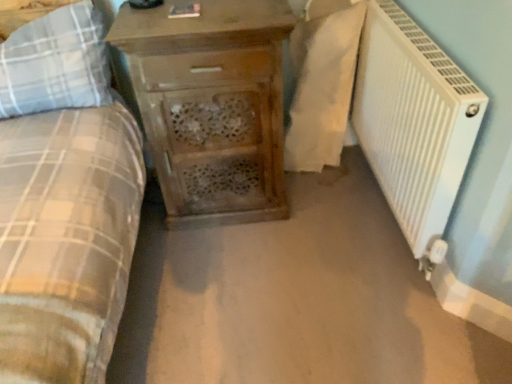
This screenshot has height=384, width=512. What do you see at coordinates (55, 63) in the screenshot? I see `plaid fabric pillow at left` at bounding box center [55, 63].

Measure the distance between point [21,52] and camera.

Point [21,52] is 4.49 feet away from camera.

The image size is (512, 384). Describe the element at coordinates (322, 88) in the screenshot. I see `white fabric at right` at that location.

At what (x,y) coordinates should I click in order to perform the action: click on white fabric at right. Please return your answer as a coordinate pair (x, y). The image size is (512, 384). Looking at the image, I should click on (322, 88).

What is the approximate width of white textured radiator at right?

white textured radiator at right is 11.91 centimeters in width.

The height and width of the screenshot is (384, 512). What do you see at coordinates (414, 124) in the screenshot?
I see `white textured radiator at right` at bounding box center [414, 124].

What do you see at coordinates (211, 106) in the screenshot?
I see `wooden chest of drawers at center` at bounding box center [211, 106].

Locate an element on the screen. The image size is (512, 384). plaid fabric pillow at left is located at coordinates [55, 63].

Visually, is wooden chest of drawers at center positioned to the left or to the right of plaid fabric pillow at left?

wooden chest of drawers at center is positioned on plaid fabric pillow at left's right side.

Which of these two, wooden chest of drawers at center or plaid fabric pillow at left, is thinner?

plaid fabric pillow at left is thinner.

Is wooden chest of drawers at center facing away from plaid fabric pillow at left?

No, wooden chest of drawers at center is not facing away from plaid fabric pillow at left.

Between white textured radiator at right and plaid fabric pillow at left, which one has larger size?

white textured radiator at right is bigger.

What are the coordinates of `pillow lying above the white textured radiator at right (from the image's perspective)` in the screenshot? It's located at (55, 63).

How far apart are white textured radiator at right and plaid fabric pillow at left?

They are 1.07 meters apart.

Considering the points (366, 120) and (101, 61), which point is behind, point (366, 120) or point (101, 61)?

The point (366, 120) is farther.

Would you say white fabric at right is inside or outside wooden chest of drawers at center?

white fabric at right cannot be found inside wooden chest of drawers at center.

Is white fabric at right facing away from wooden chest of drawers at center?

That's not correct — white fabric at right is not looking away from wooden chest of drawers at center.

Which of these two, white fabric at right or wooden chest of drawers at center, is wider?

With larger width is wooden chest of drawers at center.

Who is bigger, white fabric at right or wooden chest of drawers at center?

wooden chest of drawers at center.

Is point (317, 23) closer to viewer compared to point (412, 95)?

No, it is not.

Based on the photo, relative to white textured radiator at right, is white fabric at right in front or behind?

white fabric at right is positioned farther from the viewer than white textured radiator at right.

Is white fabric at right spatially inside white textured radiator at right, or outside of it?

white fabric at right exists outside the volume of white textured radiator at right.

Is white textured radiator at right at the back of white fabric at right?

No, white fabric at right's orientation is not away from white textured radiator at right.

Is plaid fabric pillow at left thinner than white textured radiator at right?

No, plaid fabric pillow at left is not thinner than white textured radiator at right.

Is white textured radiator at right at the back of plaid fabric pillow at left?

plaid fabric pillow at left does not have its back to white textured radiator at right.

Who is shorter, plaid fabric pillow at left or white textured radiator at right?

Standing shorter between the two is plaid fabric pillow at left.

From the image's perspective, which one is positioned higher, plaid fabric pillow at left or white textured radiator at right?

plaid fabric pillow at left.

Looking at this image, is wooden chest of drawers at center to the right of white fabric at right from the viewer's perspective?

Incorrect, wooden chest of drawers at center is not on the right side of white fabric at right.

Would you say wooden chest of drawers at center is inside or outside white fabric at right?

The correct answer is: outside.

From the image's perspective, does wooden chest of drawers at center appear higher than white fabric at right?

No, from the image's perspective, wooden chest of drawers at center is not on top of white fabric at right.

Who is smaller, white textured radiator at right or white fabric at right?

Smaller between the two is white textured radiator at right.

Considering the relative sizes of white textured radiator at right and white fabric at right in the image provided, is white textured radiator at right wider than white fabric at right?

No.

Can white fabric at right be found inside white textured radiator at right?

No, white fabric at right is located outside of white textured radiator at right.

From the image's perspective, is white textured radiator at right located beneath white fabric at right?

Yes, from the image's perspective, white textured radiator at right is below white fabric at right.

The image size is (512, 384). What are the coordinates of `pillow that appears above the wooden chest of drawers at center (from the image's perspective)` in the screenshot? It's located at (55, 63).

Identify the location of radiator below the plaid fabric pillow at left (from the image's perspective). (414, 124).

From the image, which object appears to be nearer to wooden chest of drawers at center, plaid fabric pillow at left or white textured radiator at right?

The object closer to wooden chest of drawers at center is plaid fabric pillow at left.

Which object lies nearer to the anchor point white fabric at right, wooden chest of drawers at center or plaid fabric pillow at left?

wooden chest of drawers at center is closer to white fabric at right.

Estimate the real-world distances between objects in this image. Which object is further from wooden chest of drawers at center, white fabric at right or white textured radiator at right?

Among the two, white textured radiator at right is located further to wooden chest of drawers at center.

From the picture: When comparing their distances from plaid fabric pillow at left, does wooden chest of drawers at center or white textured radiator at right seem closer?

Among the two, wooden chest of drawers at center is located nearer to plaid fabric pillow at left.

In the scene shown: Estimate the real-world distances between objects in this image. Which object is further from plaid fabric pillow at left, white textured radiator at right or wooden chest of drawers at center?

Based on the image, white textured radiator at right appears to be further to plaid fabric pillow at left.

From the image, which object appears to be farther from white textured radiator at right, plaid fabric pillow at left or white fabric at right?

plaid fabric pillow at left.

Considering their positions, is plaid fabric pillow at left positioned further to wooden chest of drawers at center than white fabric at right?

white fabric at right is positioned further to the anchor wooden chest of drawers at center.

When comparing their distances from white textured radiator at right, does plaid fabric pillow at left or wooden chest of drawers at center seem closer?

wooden chest of drawers at center is closer to white textured radiator at right.

Identify the location of chest of drawers between plaid fabric pillow at left and white fabric at right. The height and width of the screenshot is (384, 512). (211, 106).

Locate an element on the screen. sheet situated between wooden chest of drawers at center and white textured radiator at right from left to right is located at coordinates (x=322, y=88).

Find the location of a particular element. This screenshot has height=384, width=512. chest of drawers between plaid fabric pillow at left and white textured radiator at right in the horizontal direction is located at coordinates (211, 106).

Image resolution: width=512 pixels, height=384 pixels. What are the coordinates of `sheet situated between plaid fabric pillow at left and white textured radiator at right from left to right` in the screenshot? It's located at (322, 88).